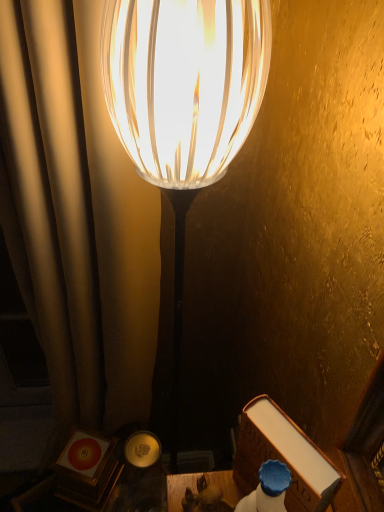
Question: Is the depth of wooden table at lower center greater than that of translucent glass lamp at center?

Choices:
 (A) yes
 (B) no

Answer: (A)

Question: Is wooden table at lower center positioned far away from translucent glass lamp at center?

Choices:
 (A) yes
 (B) no

Answer: (B)

Question: Is translucent glass lamp at center at the back of wooden table at lower center?

Choices:
 (A) yes
 (B) no

Answer: (B)

Question: Does wooden table at lower center appear on the right side of translucent glass lamp at center?

Choices:
 (A) yes
 (B) no

Answer: (A)

Question: Considering the relative sizes of wooden table at lower center and translucent glass lamp at center in the image provided, is wooden table at lower center wider than translucent glass lamp at center?

Choices:
 (A) no
 (B) yes

Answer: (A)

Question: From a real-world perspective, is wooden table at lower center positioned above or below translucent glass lamp at center?

Choices:
 (A) below
 (B) above

Answer: (B)

Question: In terms of height, does wooden table at lower center look taller or shorter compared to translucent glass lamp at center?

Choices:
 (A) tall
 (B) short

Answer: (B)

Question: Would you say wooden table at lower center is inside or outside translucent glass lamp at center?

Choices:
 (A) outside
 (B) inside

Answer: (A)

Question: Does point (226, 486) appear closer or farther from the camera than point (180, 184)?

Choices:
 (A) closer
 (B) farther

Answer: (B)

Question: Is translucent glass lamp at center spatially inside wooden table at lower center, or outside of it?

Choices:
 (A) outside
 (B) inside

Answer: (A)

Question: In terms of height, does translucent glass lamp at center look taller or shorter compared to wooden table at lower center?

Choices:
 (A) short
 (B) tall

Answer: (B)

Question: Is translucent glass lamp at center wider or thinner than wooden table at lower center?

Choices:
 (A) thin
 (B) wide

Answer: (B)

Question: Relative to wooden table at lower center, is translucent glass lamp at center in front or behind?

Choices:
 (A) behind
 (B) front

Answer: (B)

Question: Considering their positions, is wooden table at lower center located in front of or behind brown leather book at lower right?

Choices:
 (A) front
 (B) behind

Answer: (B)

Question: From the image's perspective, relative to brown leather book at lower right, is wooden table at lower center above or below?

Choices:
 (A) below
 (B) above

Answer: (A)